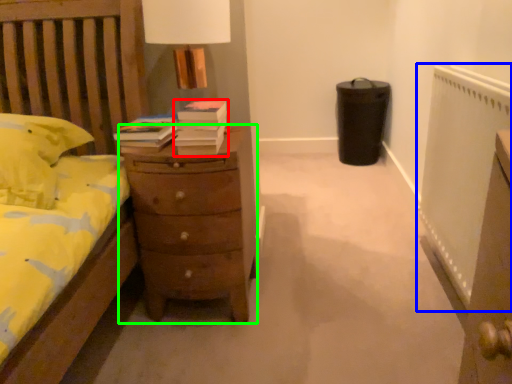
Question: Based on their relative distances, which object is farther from book (highlighted by a red box)? Choose from radiator (highlighted by a blue box) and chest of drawers (highlighted by a green box).

Choices:
 (A) radiator
 (B) chest of drawers

Answer: (A)